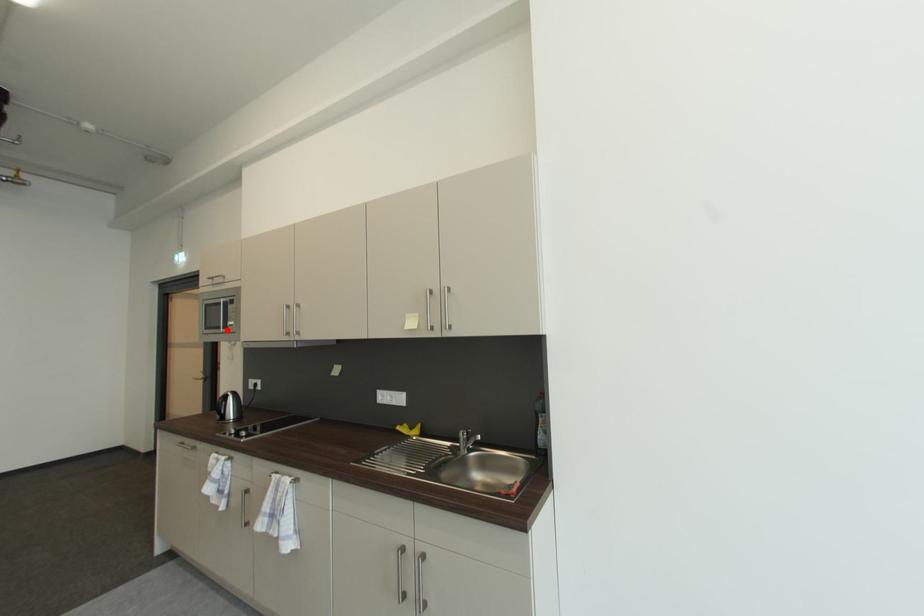
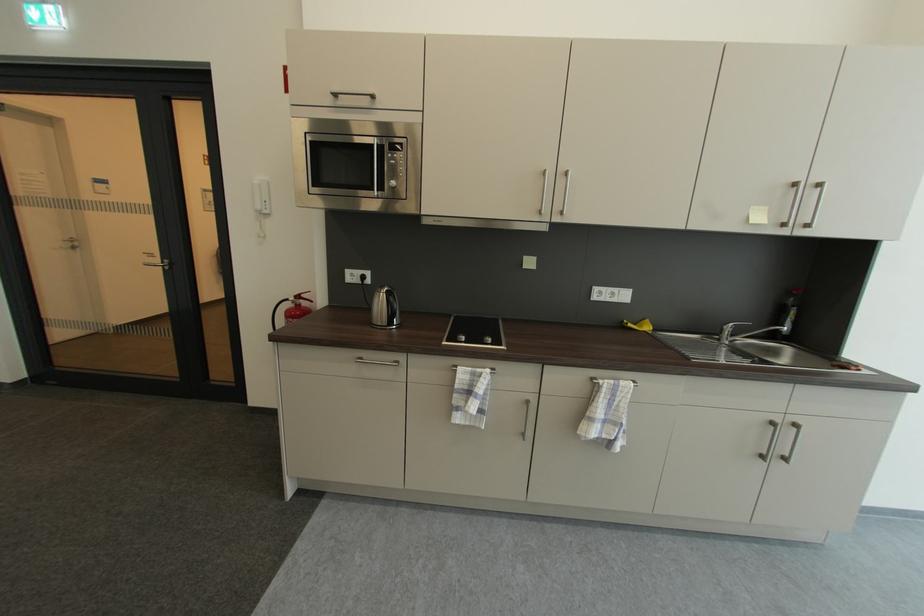
The point at the highlighted location is marked in the first image. Where is the corresponding point in the second image?

(380, 191)